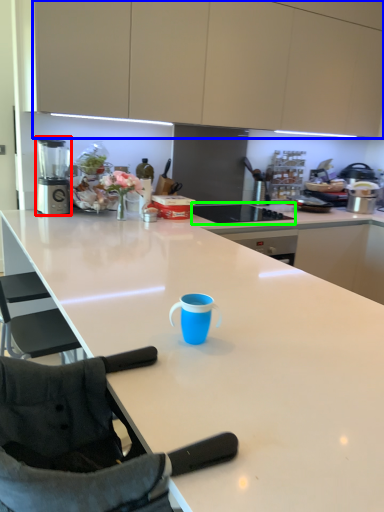
Question: Based on their relative distances, which object is farther from blender (highlighted by a red box)? Choose from cabinetry (highlighted by a blue box) and home appliance (highlighted by a green box).

Choices:
 (A) cabinetry
 (B) home appliance

Answer: (B)